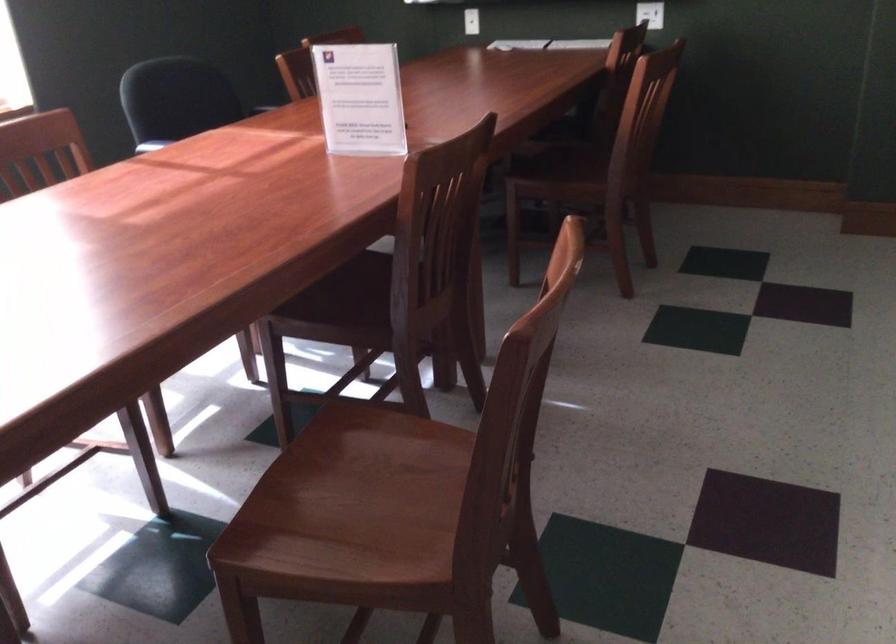
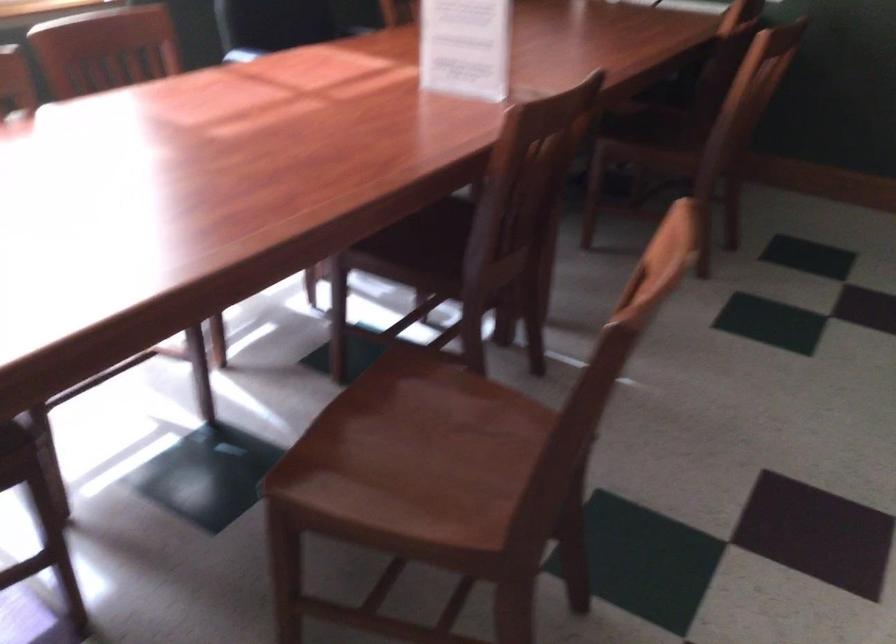
Locate, in the second image, the point that corresponds to pixel 345 305 in the first image.

(418, 247)